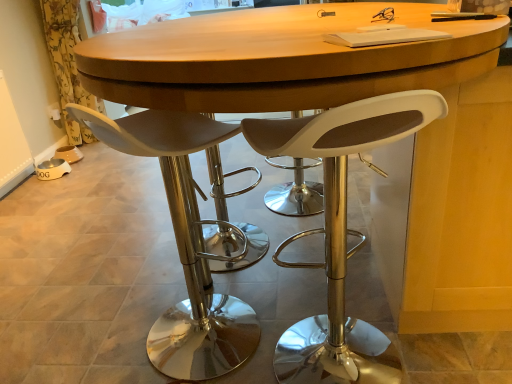
Question: Would you say white matte stool at center, acting as the second chair starting from the right, is outside white matte stool at center, which is the second chair from left to right?

Choices:
 (A) yes
 (B) no

Answer: (A)

Question: Can you confirm if white matte stool at center, acting as the second chair starting from the right, is thinner than white matte stool at center, which is the second chair from left to right?

Choices:
 (A) yes
 (B) no

Answer: (A)

Question: Is white matte stool at center, arranged as the first chair when viewed from the left, bigger than white matte stool at center, which is the second chair from left to right?

Choices:
 (A) yes
 (B) no

Answer: (B)

Question: From the image's perspective, does white matte stool at center, acting as the second chair starting from the right, appear lower than white matte stool at center, which is the second chair from left to right?

Choices:
 (A) yes
 (B) no

Answer: (B)

Question: Can white matte stool at center, which is the second chair from left to right, be found inside white matte stool at center, arranged as the first chair when viewed from the left?

Choices:
 (A) no
 (B) yes

Answer: (A)

Question: Do you think yellow floral fabric at left is within white matte stool at center, which is the second chair from left to right, or outside of it?

Choices:
 (A) inside
 (B) outside

Answer: (B)

Question: From the image's perspective, is yellow floral fabric at left above or below white matte stool at center, which is the first chair from right to left?

Choices:
 (A) below
 (B) above

Answer: (B)

Question: Considering the positions of yellow floral fabric at left and white matte stool at center, which is the first chair from right to left, in the image, is yellow floral fabric at left wider or thinner than white matte stool at center, which is the first chair from right to left,?

Choices:
 (A) thin
 (B) wide

Answer: (A)

Question: Relative to white matte stool at center, which is the first chair from right to left, is yellow floral fabric at left in front or behind?

Choices:
 (A) behind
 (B) front

Answer: (A)

Question: In terms of size, does white matte stool at center, which is the first chair from right to left, appear bigger or smaller than yellow floral fabric at left?

Choices:
 (A) small
 (B) big

Answer: (B)

Question: Looking at their shapes, would you say white matte stool at center, which is the first chair from right to left, is wider or thinner than yellow floral fabric at left?

Choices:
 (A) wide
 (B) thin

Answer: (A)

Question: Visually, is white matte stool at center, which is the second chair from left to right, positioned to the left or to the right of yellow floral fabric at left?

Choices:
 (A) left
 (B) right

Answer: (B)

Question: Is white matte stool at center, which is the second chair from left to right, inside the boundaries of yellow floral fabric at left, or outside?

Choices:
 (A) inside
 (B) outside

Answer: (B)

Question: Do you think white matte stool at center, arranged as the first chair when viewed from the left, is within white matte stool at center, which is the second chair from left to right, or outside of it?

Choices:
 (A) inside
 (B) outside

Answer: (B)

Question: Based on their sizes in the image, would you say white matte stool at center, arranged as the first chair when viewed from the left, is bigger or smaller than white matte stool at center, which is the first chair from right to left?

Choices:
 (A) big
 (B) small

Answer: (B)